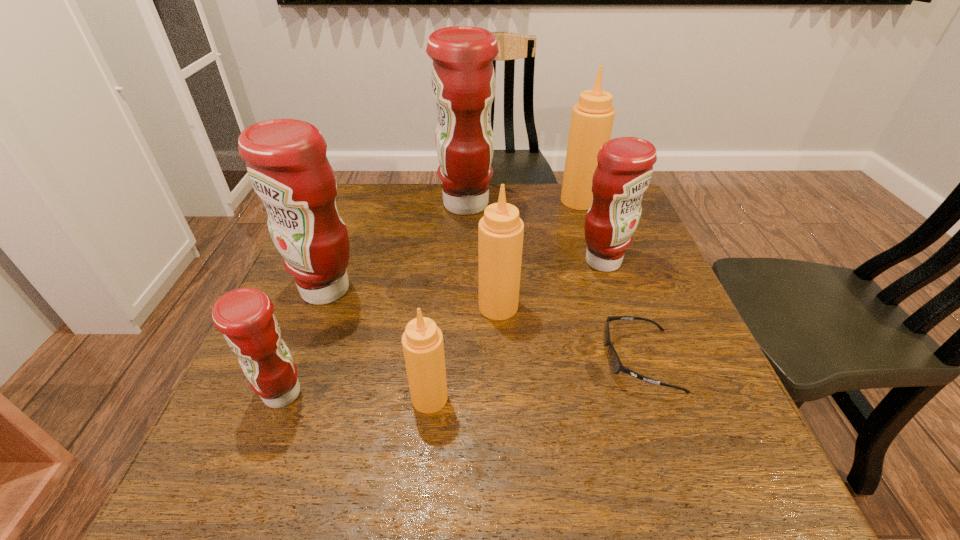
Point out which red condiment is positioned as the second nearest to the sunglasses. Please provide its 2D coordinates. Your answer should be formatted as a tuple, i.e. [(x, y)], where the tuple contains the x and y coordinates of a point satisfying the conditions above.

[(463, 79)]

Image resolution: width=960 pixels, height=540 pixels. Find the location of `red condiment identified as the second closest to the shortest object`. red condiment identified as the second closest to the shortest object is located at coordinates (463, 79).

The image size is (960, 540). Identify the location of tan condiment that is the closest to the smallest red condiment. (422, 341).

Locate an element on the screen. tan condiment that is the third nearest to the third smallest red condiment is located at coordinates (592, 118).